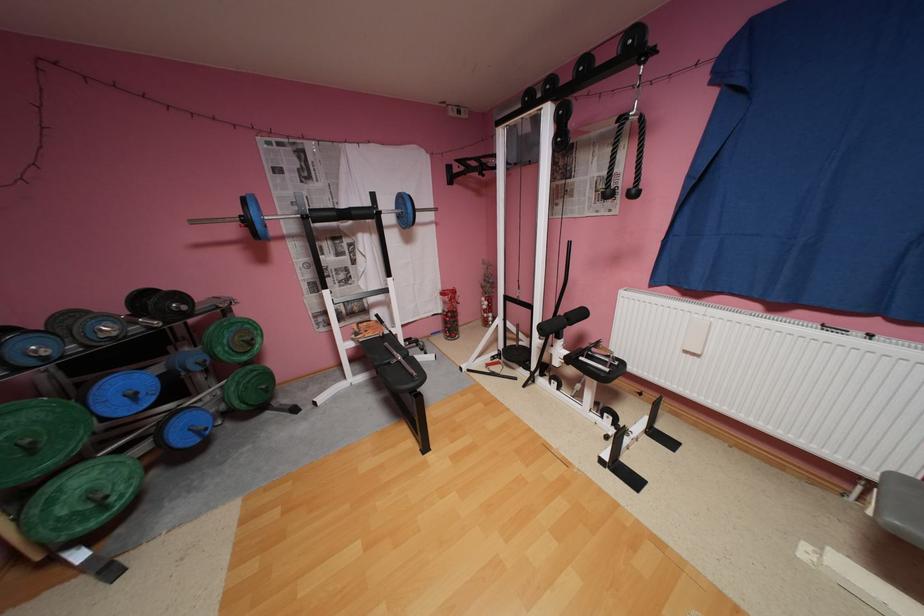
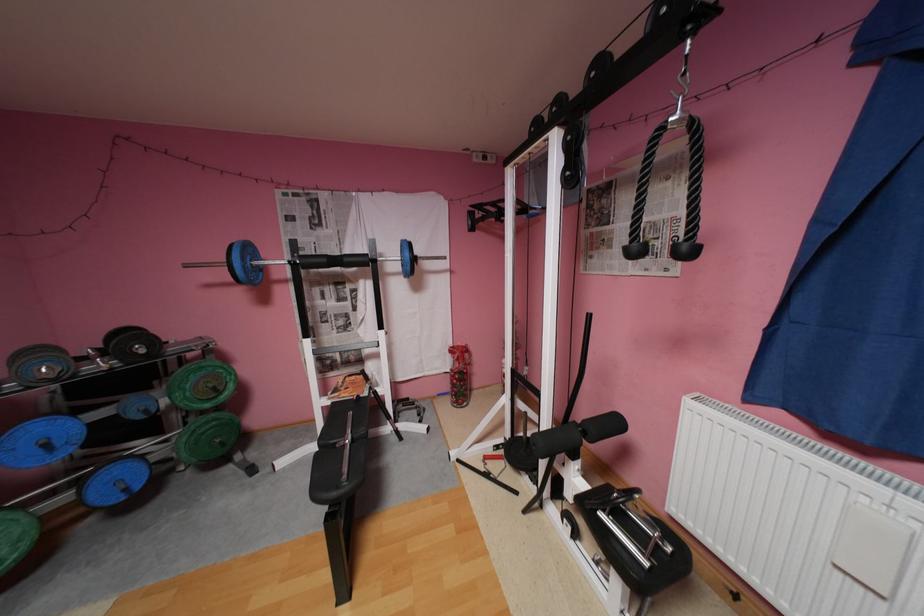
The point at (455,315) is marked in the first image. Where is the corresponding point in the second image?

(462, 377)